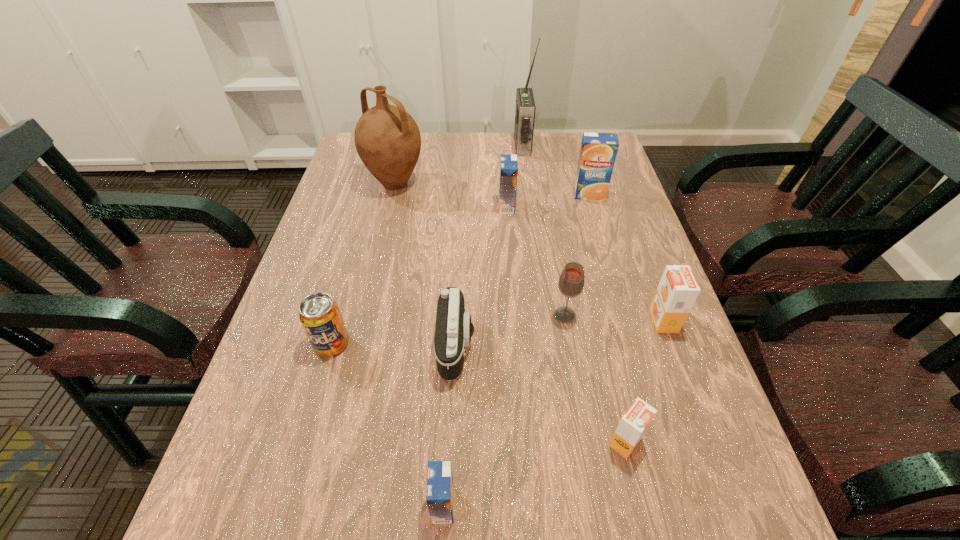
You are a GUI agent. You are given a task and a screenshot of the screen. Output one action in this format:
    pyautogui.click(x=<x>, y=<y>)
    Task: Click on the free space located 0.060m on the right of the rightmost blue orange_juice
    The image size is (960, 540).
    Given the screenshot: What is the action you would take?
    pyautogui.click(x=626, y=194)

Locate an element on the screen. The image size is (960, 540). free region located on the front of the glass drink container is located at coordinates (599, 517).

At what (x,y) coordinates should I click in order to perform the action: click on vacant space located 0.120m on the left of the second smallest blue orange_juice. Please return your answer as a coordinate pair (x, y). The width and height of the screenshot is (960, 540). Looking at the image, I should click on (456, 206).

This screenshot has width=960, height=540. Find the location of `vacant space situated 0.160m on the front of the farther orange orange juice`. vacant space situated 0.160m on the front of the farther orange orange juice is located at coordinates (693, 402).

The image size is (960, 540). I want to click on free location located on the right of the soda can, so click(441, 343).

You are a GUI agent. You are given a task and a screenshot of the screen. Output one action in this format:
    pyautogui.click(x=<x>, y=<y>)
    Task: Click on the vacant space located on the front lens of the camera
    This screenshot has width=960, height=540.
    Given the screenshot: What is the action you would take?
    pyautogui.click(x=581, y=345)

This screenshot has width=960, height=540. What are the coordinates of `free space located 0.180m on the left of the second nearest object` in the screenshot? It's located at (506, 442).

This screenshot has height=540, width=960. I want to click on vacant region located on the left of the nearest orange_juice, so (319, 505).

The image size is (960, 540). I want to click on radio receiver that is at the far edge, so pos(525,108).

You are a GUI agent. You are given a task and a screenshot of the screen. Output one action in this format:
    pyautogui.click(x=<x>, y=<y>)
    Task: Click on the pitcher at the far edge
    Image resolution: width=960 pixels, height=540 pixels.
    Given the screenshot: What is the action you would take?
    pyautogui.click(x=387, y=139)